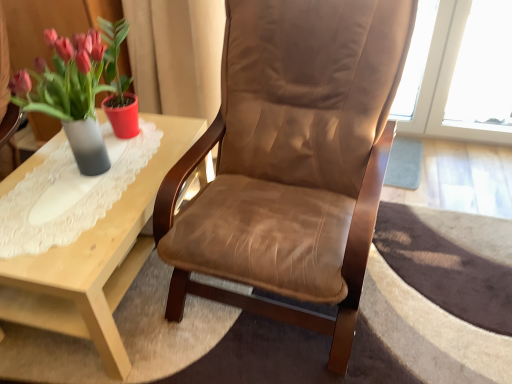
Question: Is brown leather chair at center completely or partially inside light wood coffee table at left?

Choices:
 (A) no
 (B) yes

Answer: (A)

Question: Can you confirm if light wood coffee table at left is shorter than brown leather chair at center?

Choices:
 (A) yes
 (B) no

Answer: (A)

Question: Considering the relative sizes of light wood coffee table at left and brown leather chair at center in the image provided, is light wood coffee table at left thinner than brown leather chair at center?

Choices:
 (A) no
 (B) yes

Answer: (A)

Question: From the image's perspective, is light wood coffee table at left located beneath brown leather chair at center?

Choices:
 (A) no
 (B) yes

Answer: (B)

Question: Is light wood coffee table at left facing towards brown leather chair at center?

Choices:
 (A) no
 (B) yes

Answer: (A)

Question: From a real-world perspective, is light wood coffee table at left positioned over brown leather chair at center based on gravity?

Choices:
 (A) no
 (B) yes

Answer: (A)

Question: Does brown leather chair at center have a greater height compared to matte gray vase at left?

Choices:
 (A) yes
 (B) no

Answer: (A)

Question: From the image's perspective, is brown leather chair at center under matte gray vase at left?

Choices:
 (A) yes
 (B) no

Answer: (A)

Question: Could you tell me if brown leather chair at center is facing matte gray vase at left?

Choices:
 (A) no
 (B) yes

Answer: (A)

Question: Is brown leather chair at center to the right of matte gray vase at left from the viewer's perspective?

Choices:
 (A) no
 (B) yes

Answer: (B)

Question: Is brown leather chair at center positioned before matte gray vase at left?

Choices:
 (A) no
 (B) yes

Answer: (B)

Question: Considering the relative sizes of brown leather chair at center and matte gray vase at left in the image provided, is brown leather chair at center bigger than matte gray vase at left?

Choices:
 (A) yes
 (B) no

Answer: (A)

Question: Can you confirm if matte gray vase at left is positioned to the right of brown leather chair at center?

Choices:
 (A) no
 (B) yes

Answer: (A)